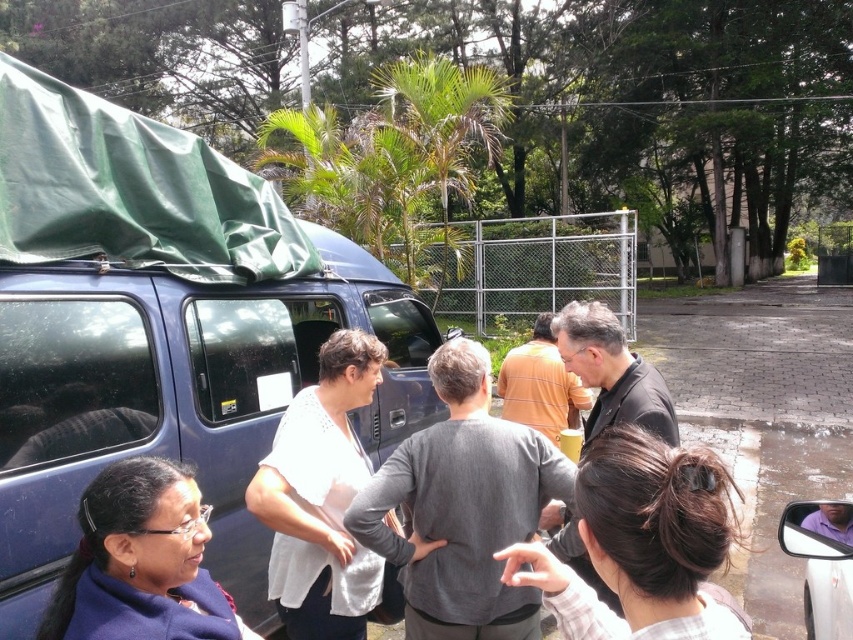
You are a delivery person who needs to load a package into the matte blue minivan at center. You see the blue fabric jacket at lower left. Is the jacket in a position that might block your access to the minivan?

The blue fabric jacket at lower left is behind the matte blue minivan at center, so it is not blocking the access to the minivan.

You are organizing a group photo and need to arrange two people wearing the white textured shirt at center and the blue fabric jacket at lower left. If you want to place them side by side with their clothing widths matching, which person should you adjust the position of?

The blue fabric jacket at lower left should be adjusted because the white textured shirt at center has a larger width than the blue fabric jacket at lower left, so the person wearing the blue fabric jacket at lower left needs to move closer to match the width of the white textured shirt at center.